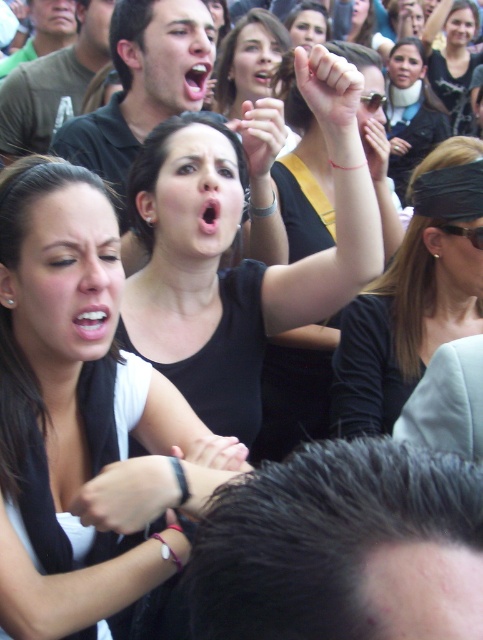
You are a photographer at this event, and you want to capture a closeup shot of the black matte shirt at center without the matte black fist at center appearing in the frame. Given that your camera has a fixed focal length and you can only move closer or farther away, what is the minimum distance you need to be from the subject to ensure the fist is out of the frame?

The minimum distance required is 18.75 inches. Since the black matte shirt at center and the matte black fist at center are 18.75 inches apart, moving to this distance would allow the camera to focus closely on the shirt while keeping the fist out of the frame.

You are a photographer trying to capture a closeup of the matte black shirt at upper right and the white skin at raised fist in the crowd scene. Which object should you focus on first to ensure it appears sharp in your photo?

You should focus on the matte black shirt at upper right first because it is closer to you than the white skin at raised fist, ensuring it stays sharp while the background may blur slightly.

You are a photographer trying to capture the interaction between the black matte shirt at center and the matte black fist at center. Which object should you focus on first if you want to photograph the subject on the left side?

The black matte shirt at center is positioned on the left side of the matte black fist at center, so you should focus on the black matte shirt at center first to capture the subject on the left side.